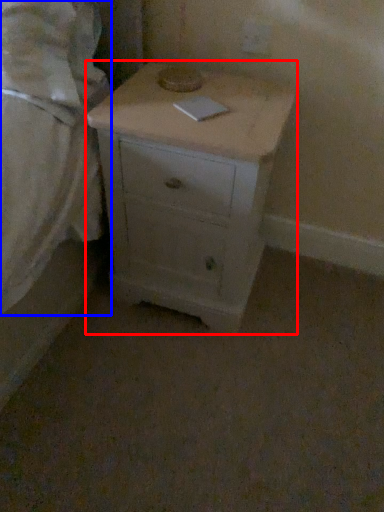
Question: Among these objects, which one is nearest to the camera, chest of drawers (highlighted by a red box) or bed (highlighted by a blue box)?

Choices:
 (A) chest of drawers
 (B) bed

Answer: (B)